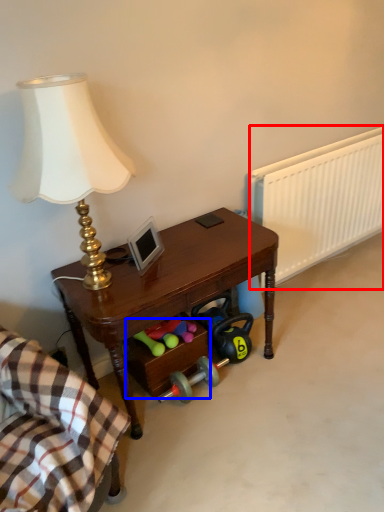
Question: Which object is closer to the camera taking this photo, radiator (highlighted by a red box) or drawer (highlighted by a blue box)?

Choices:
 (A) radiator
 (B) drawer

Answer: (B)